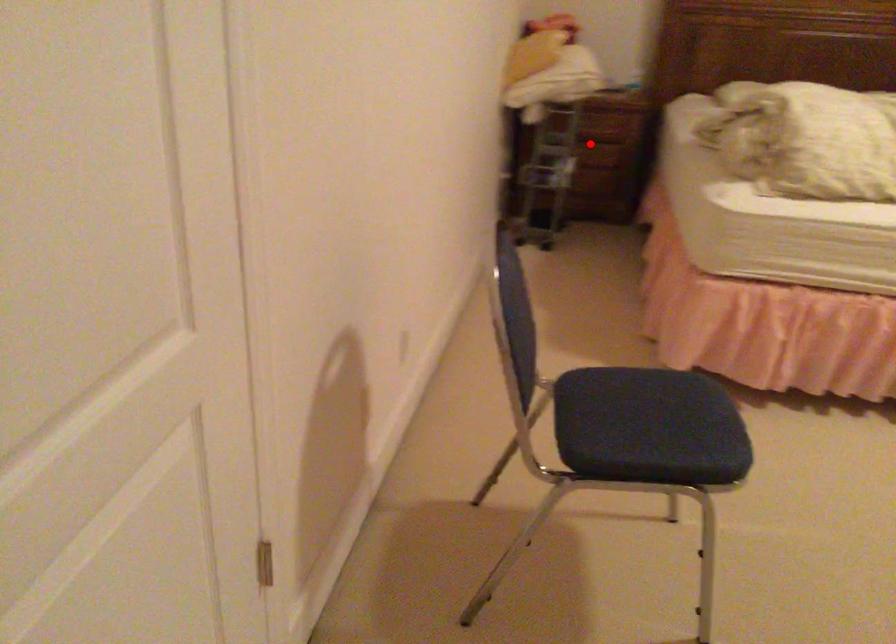
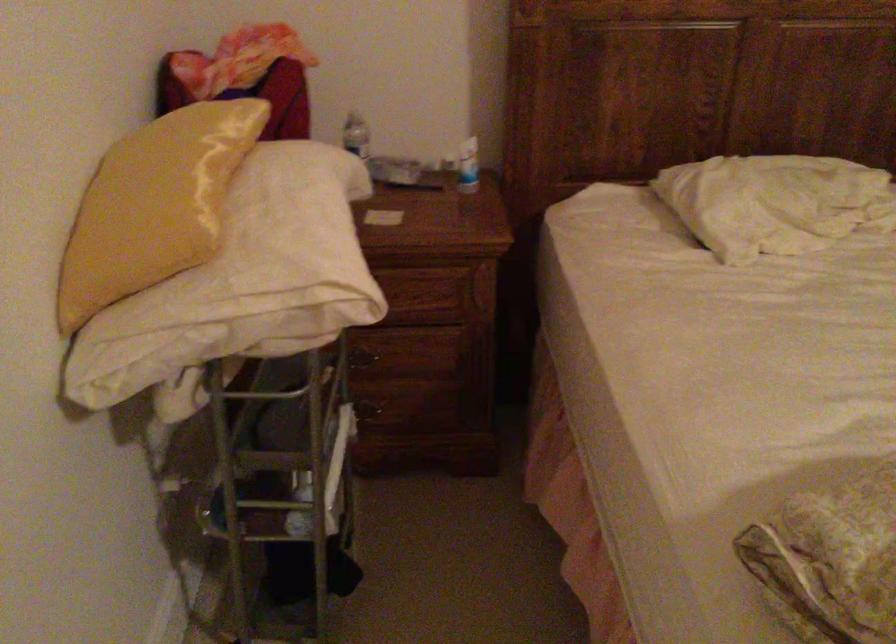
In the second image, find the point that corresponds to the highlighted location in the first image.

(412, 365)